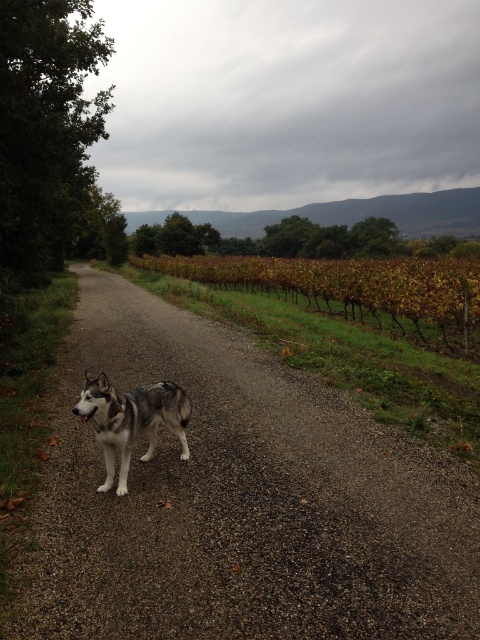
At what (x,y) coordinates should I click in order to perform the action: click on gray gravel road at center. Please return your answer as a coordinate pair (x, y). This screenshot has height=640, width=480. Looking at the image, I should click on (240, 502).

Is gray gravel road at center to the left of gray fur dog at center from the viewer's perspective?

In fact, gray gravel road at center is to the right of gray fur dog at center.

Measure the distance between point (118, 577) and camera.

A distance of 3.39 meters exists between point (118, 577) and camera.

This screenshot has height=640, width=480. What are the coordinates of `gray gravel road at center` in the screenshot? It's located at (240, 502).

Can you confirm if green leafy vines at center is positioned below gray fur dog at center?

No.

Who is positioned more to the left, green leafy vines at center or gray fur dog at center?

From the viewer's perspective, gray fur dog at center appears more on the left side.

Which is in front, point (443, 332) or point (180, 410)?

Positioned in front is point (180, 410).

This screenshot has width=480, height=640. I want to click on green leafy vines at center, so click(356, 291).

In the scene shown: Between gray gravel road at center and green leafy vines at center, which one appears on the left side from the viewer's perspective?

gray gravel road at center

Measure the distance between gray gravel road at center and camera.

gray gravel road at center and camera are 2.86 meters apart from each other.

Which is behind, point (294, 637) or point (245, 278)?

Positioned behind is point (245, 278).

Find the location of `gray gravel road at center`. gray gravel road at center is located at coordinates (240, 502).